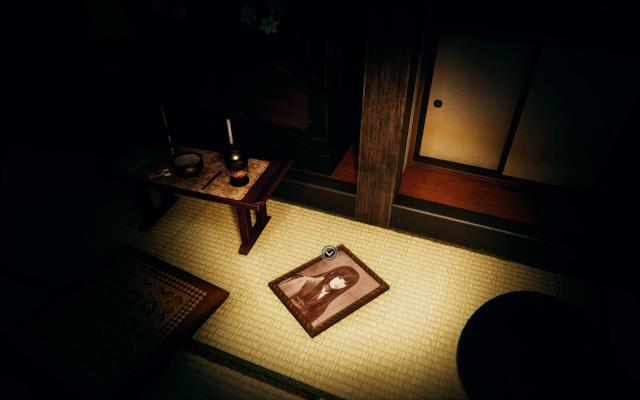
Where is `candle flame`? The image size is (640, 400). candle flame is located at coordinates (233, 156).